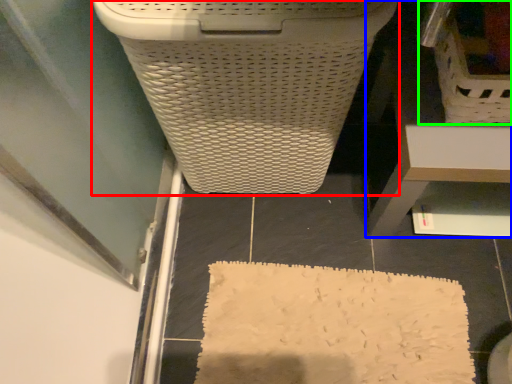
Question: Which is nearer to the waste container (highlighted by a red box)? furniture (highlighted by a blue box) or laundry basket (highlighted by a green box).

Choices:
 (A) furniture
 (B) laundry basket

Answer: (A)